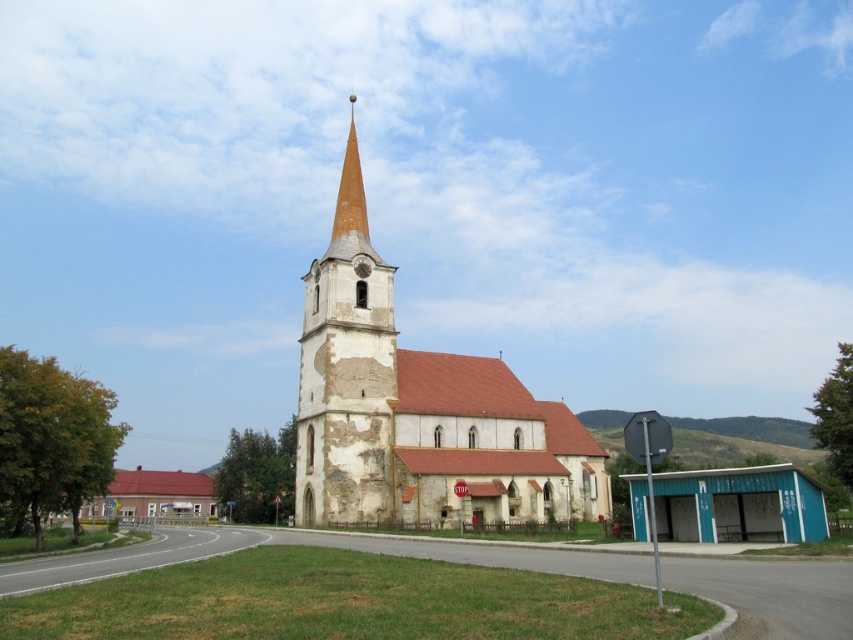
Question: Which object appears closest to the camera in this image?

Choices:
 (A) yellowish stone steeple at center
 (B) white stone church at center

Answer: (B)

Question: Among these points, which one is nearest to the camera?

Choices:
 (A) (585, 461)
 (B) (350, 275)

Answer: (B)

Question: Where is white stone church at center located in relation to yellowish stone steeple at center in the image?

Choices:
 (A) below
 (B) above

Answer: (A)

Question: Can you confirm if white stone church at center is thinner than yellowish stone steeple at center?

Choices:
 (A) yes
 (B) no

Answer: (B)

Question: Does white stone church at center appear on the right side of yellowish stone steeple at center?

Choices:
 (A) no
 (B) yes

Answer: (B)

Question: Among these objects, which one is nearest to the camera?

Choices:
 (A) yellowish stone steeple at center
 (B) white stone church at center

Answer: (B)